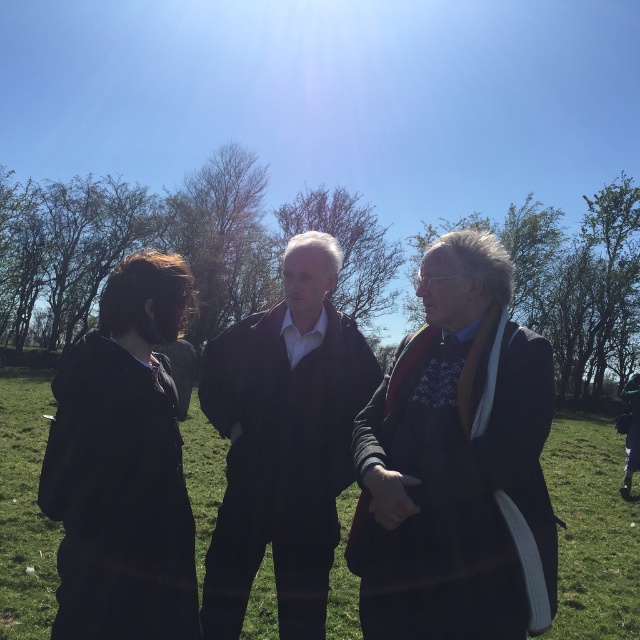
Image resolution: width=640 pixels, height=640 pixels. What do you see at coordinates (456, 461) in the screenshot?
I see `dark gray suit at center` at bounding box center [456, 461].

Which of these two, dark gray suit at center or matte black jacket at center, stands taller?

matte black jacket at center is taller.

Where is `dark gray suit at center`? dark gray suit at center is located at coordinates (456, 461).

Identify the location of dark gray suit at center. This screenshot has width=640, height=640. (456, 461).

Does matte black jacket at center have a lesser height compared to green grass at center?

Correct, matte black jacket at center is not as tall as green grass at center.

What do you see at coordinates (284, 442) in the screenshot?
I see `matte black jacket at center` at bounding box center [284, 442].

Locate an element on the screen. The height and width of the screenshot is (640, 640). matte black jacket at center is located at coordinates (284, 442).

Which of these two, black fabric jacket at left or matte black jacket at center, stands shorter?

black fabric jacket at left

Can you confirm if black fabric jacket at left is wider than matte black jacket at center?

No, black fabric jacket at left is not wider than matte black jacket at center.

Measure the distance between black fabric jacket at left and camera.

black fabric jacket at left and camera are 1.96 meters apart from each other.

Identify the location of black fabric jacket at left. Image resolution: width=640 pixels, height=640 pixels. (122, 465).